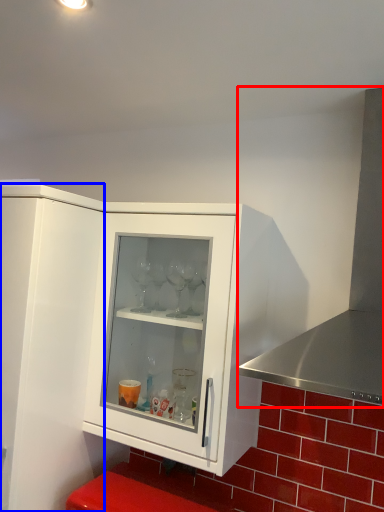
Question: Which of the following is the farthest to the observer, exhaust hood (highlighted by a red box) or cupboard (highlighted by a blue box)?

Choices:
 (A) exhaust hood
 (B) cupboard

Answer: (B)